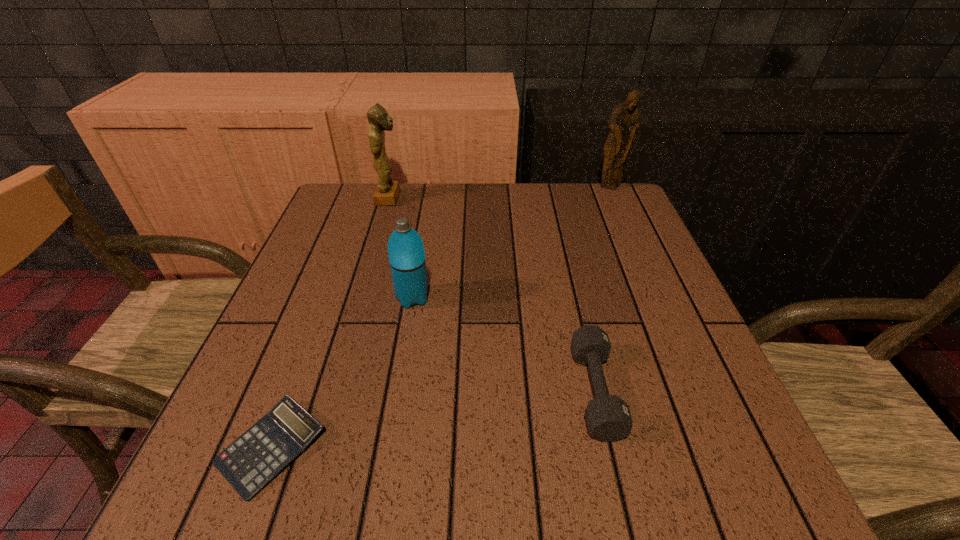
Where is `the right figurine`? The width and height of the screenshot is (960, 540). the right figurine is located at coordinates (623, 125).

This screenshot has height=540, width=960. I want to click on the left figurine, so click(x=387, y=191).

The height and width of the screenshot is (540, 960). What are the coordinates of `the third farthest object` in the screenshot? It's located at (406, 253).

The image size is (960, 540). I want to click on thermos bottle, so click(406, 253).

The height and width of the screenshot is (540, 960). What are the coordinates of `the second object from right to left` in the screenshot? It's located at (608, 417).

Locate an element on the screen. dumbbell is located at coordinates (608, 417).

At what (x,y) coordinates should I click in order to perform the action: click on the shortest object. Please return your answer as a coordinate pair (x, y). The width and height of the screenshot is (960, 540). Looking at the image, I should click on (249, 463).

I want to click on vacant space positioned 0.400m on the front-facing side of the rightmost object, so (x=655, y=288).

The width and height of the screenshot is (960, 540). I want to click on vacant space located on the front-facing side of the left figurine, so click(x=493, y=198).

The width and height of the screenshot is (960, 540). Identify the location of free space located on the right of the thermos bottle. (618, 298).